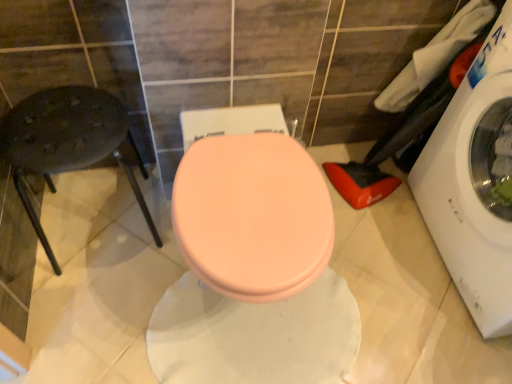
Question: Is white fabric at upper right, placed as the 1th laundry when sorted from left to right, closer to camera compared to matte pink toilet seat at center?

Choices:
 (A) yes
 (B) no

Answer: (B)

Question: Is the position of white fabric at upper right, acting as the second laundry starting from the right, more distant than that of matte pink toilet seat at center?

Choices:
 (A) no
 (B) yes

Answer: (B)

Question: Is white fabric at upper right, acting as the second laundry starting from the right, facing away from matte pink toilet seat at center?

Choices:
 (A) no
 (B) yes

Answer: (A)

Question: Are white fabric at upper right, acting as the second laundry starting from the right, and matte pink toilet seat at center making contact?

Choices:
 (A) no
 (B) yes

Answer: (A)

Question: Is white fabric at upper right, acting as the second laundry starting from the right, completely or partially outside of matte pink toilet seat at center?

Choices:
 (A) yes
 (B) no

Answer: (A)

Question: Does white fabric at upper right, placed as the 1th laundry when sorted from left to right, appear on the left side of matte pink toilet seat at center?

Choices:
 (A) yes
 (B) no

Answer: (B)

Question: Is white fabric laundry at right, the 2th laundry from the left, behind white fabric at upper right, placed as the 1th laundry when sorted from left to right?

Choices:
 (A) no
 (B) yes

Answer: (A)

Question: Does white fabric laundry at right, the 2th laundry from the left, contain white fabric at upper right, acting as the second laundry starting from the right?

Choices:
 (A) yes
 (B) no

Answer: (A)

Question: Can you confirm if white fabric laundry at right, the 2th laundry from the left, is wider than white fabric at upper right, placed as the 1th laundry when sorted from left to right?

Choices:
 (A) no
 (B) yes

Answer: (B)

Question: Is the position of white fabric laundry at right, the 2th laundry from the left, less distant than that of white fabric at upper right, acting as the second laundry starting from the right?

Choices:
 (A) no
 (B) yes

Answer: (B)

Question: From the image's perspective, would you say white fabric laundry at right, arranged as the first laundry when viewed from the right, is shown under white fabric at upper right, acting as the second laundry starting from the right?

Choices:
 (A) yes
 (B) no

Answer: (A)

Question: From a real-world perspective, is white fabric laundry at right, arranged as the first laundry when viewed from the right, physically above white fabric at upper right, placed as the 1th laundry when sorted from left to right?

Choices:
 (A) no
 (B) yes

Answer: (A)

Question: Is white fabric at upper right, acting as the second laundry starting from the right, further to camera compared to white fabric laundry at right, arranged as the first laundry when viewed from the right?

Choices:
 (A) no
 (B) yes

Answer: (B)